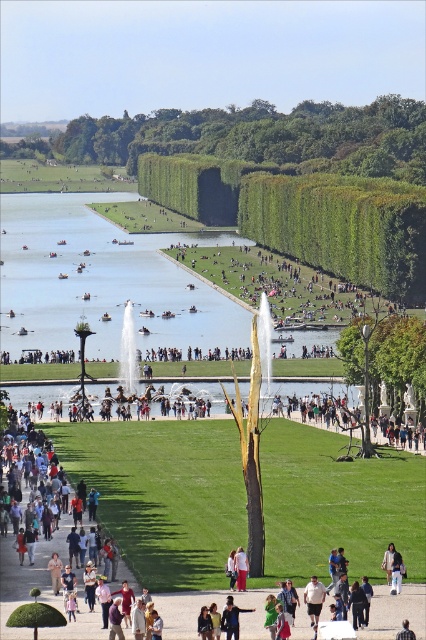
From the picture: Does green leafy tree at upper center have a smaller size compared to brown plaid shirt at center?

No, green leafy tree at upper center is not smaller than brown plaid shirt at center.

Is green leafy tree at upper center shorter than brown plaid shirt at center?

In fact, green leafy tree at upper center may be taller than brown plaid shirt at center.

What do you see at coordinates (264, 136) in the screenshot? The height and width of the screenshot is (640, 426). I see `green leafy tree at upper center` at bounding box center [264, 136].

Where is `green leafy tree at upper center`? The image size is (426, 640). green leafy tree at upper center is located at coordinates (264, 136).

Is white cotton shirt at lower center to the left of brown plaid shirt at center from the viewer's perspective?

Yes, white cotton shirt at lower center is to the left of brown plaid shirt at center.

Does white cotton shirt at lower center appear over brown plaid shirt at center?

Actually, white cotton shirt at lower center is below brown plaid shirt at center.

Measure the distance between point [316,595] and camera.

Point [316,595] is 52.81 meters away from camera.

This screenshot has width=426, height=640. Find the location of `white cotton shirt at lower center`. white cotton shirt at lower center is located at coordinates (313, 598).

Is green leafy tree at upper center thinner than white cotton shirt at lower center?

No.

Is point (377, 124) more distant than point (311, 579)?

Yes, point (377, 124) is behind point (311, 579).

Is point (183, 120) farther from camera compared to point (310, 595)?

Yes, it is.

What are the coordinates of `green leafy tree at upper center` in the screenshot? It's located at (x=264, y=136).